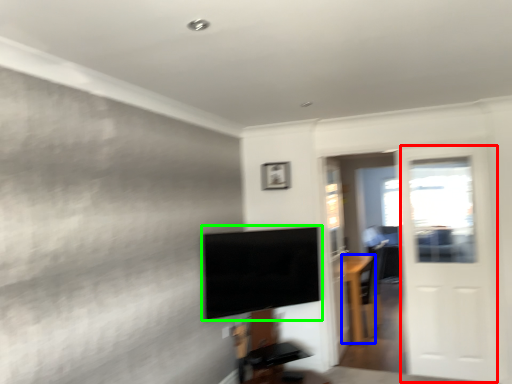
Question: Considering the real-world distances, which object is farthest from screen door (highlighted by a red box)? furniture (highlighted by a blue box) or television (highlighted by a green box)?

Choices:
 (A) furniture
 (B) television

Answer: (B)